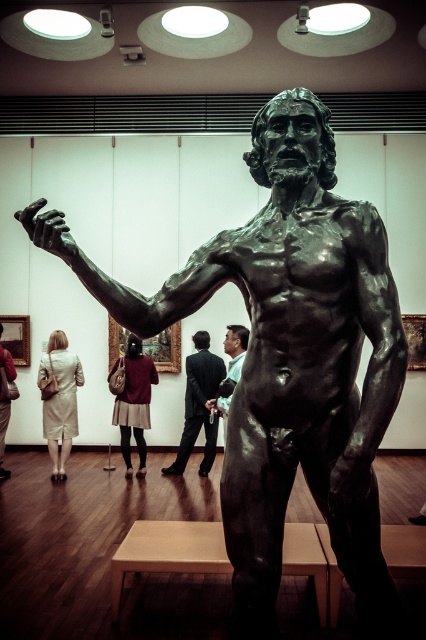
Is point (66, 404) closer to viewer compared to point (221, 403)?

No, (66, 404) is further to viewer.

Locate an element on the screen. This screenshot has width=426, height=640. light beige coat at lower left is located at coordinates (60, 400).

You are a GUI agent. You are given a task and a screenshot of the screen. Output one action in this format:
    pyautogui.click(x=<x>, y=<y>)
    Task: Click on the dark suit at center
    The image size is (426, 640).
    Given the screenshot: What is the action you would take?
    pyautogui.click(x=198, y=404)

Between point (187, 458) and point (235, 355), which one is positioned behind?

Point (187, 458)

This screenshot has width=426, height=640. Identify the location of dark suit at center. (198, 404).

The width and height of the screenshot is (426, 640). Identify the location of dark suit at center. coord(198,404).

Which is in front, point (66, 342) or point (143, 417)?

Point (66, 342)

Is light beige coat at lower left thinner than matte brown skirt at center?

Indeed, light beige coat at lower left has a lesser width compared to matte brown skirt at center.

Where is `light beige coat at lower left`? The image size is (426, 640). light beige coat at lower left is located at coordinates (60, 400).

At what (x,y) coordinates should I click in order to perform the action: click on light beige coat at lower left. Please return your answer as a coordinate pair (x, y). The image size is (426, 640). Looking at the image, I should click on (60, 400).